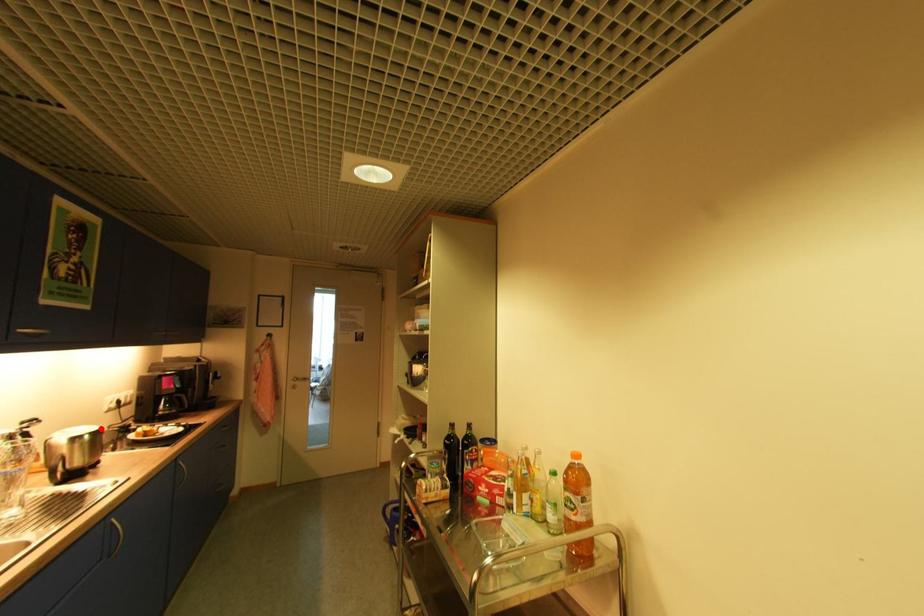
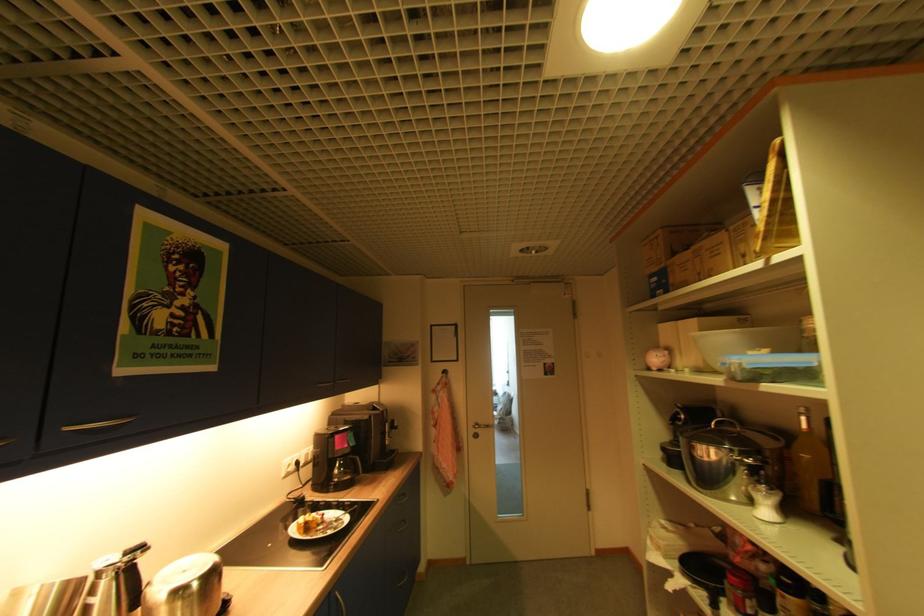
Where in the second image is the point corresponding to the highlighted location from the first image?

(217, 562)